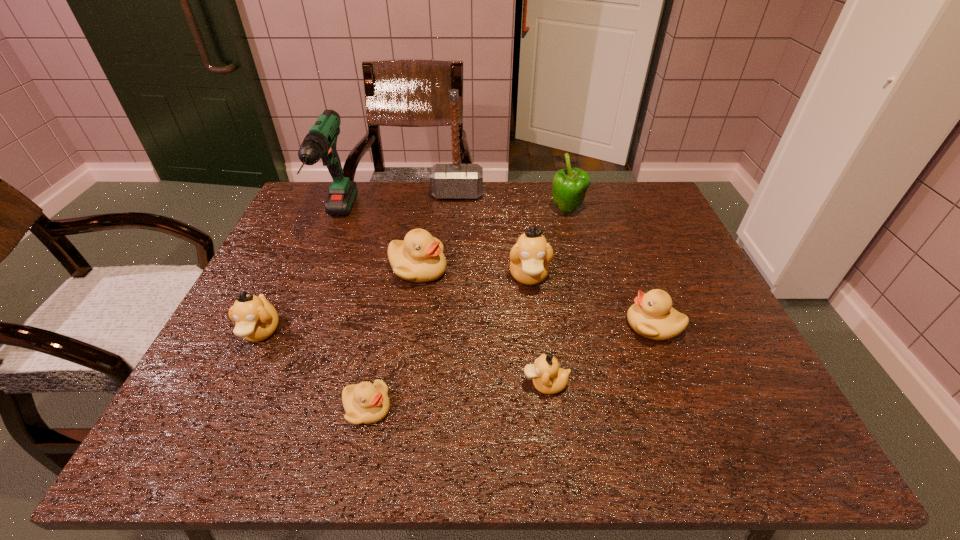
Locate an element on the screen. This screenshot has height=540, width=960. vacant region at the far right corner of the desktop is located at coordinates (627, 206).

Locate an element on the screen. This screenshot has width=960, height=540. free space between the drill and the bell pepper is located at coordinates click(x=452, y=216).

Locate an element on the screen. The height and width of the screenshot is (540, 960). free space that is in between the leftmost tan duckling and the nearest tan duckling is located at coordinates (403, 358).

You are a GUI agent. You are given a task and a screenshot of the screen. Output one action in this format:
    pyautogui.click(x=<x>, y=<y>)
    Task: Click on the free space that is in between the brown hammer and the farthest yellow duckling
    This screenshot has height=540, width=960.
    Given the screenshot: What is the action you would take?
    pyautogui.click(x=438, y=232)

Image resolution: width=960 pixels, height=540 pixels. Find the location of `empty location between the biggest yellow duckling and the leftmost duckling`. empty location between the biggest yellow duckling and the leftmost duckling is located at coordinates (339, 301).

The height and width of the screenshot is (540, 960). Find the location of `free spot between the biggest yellow duckling and the farthest tan duckling`. free spot between the biggest yellow duckling and the farthest tan duckling is located at coordinates (473, 273).

This screenshot has height=540, width=960. I want to click on empty space between the farthest tan duckling and the green bell pepper, so click(548, 244).

The height and width of the screenshot is (540, 960). In order to click on vacant space that's between the second smallest yellow duckling and the tallest duckling in this screenshot , I will do `click(591, 301)`.

You are a GUI agent. You are given a task and a screenshot of the screen. Output one action in this format:
    pyautogui.click(x=<x>, y=<y>)
    Task: Click on the unoccupied area between the nearest tan duckling and the farthest tan duckling
    
    Given the screenshot: What is the action you would take?
    pyautogui.click(x=537, y=330)

The width and height of the screenshot is (960, 540). In order to click on unoccupied position between the second farthest yellow duckling and the leftmost duckling in this screenshot , I will do `click(457, 329)`.